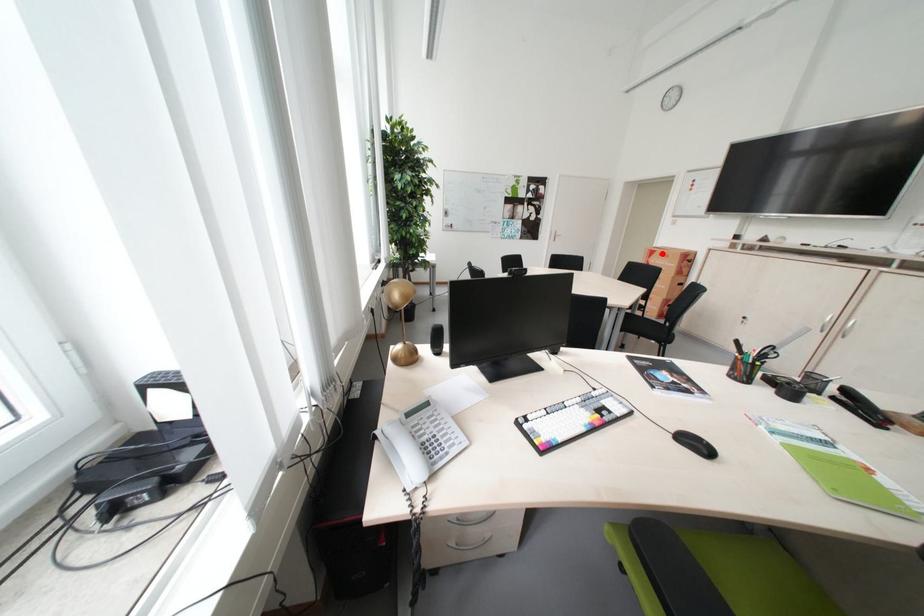
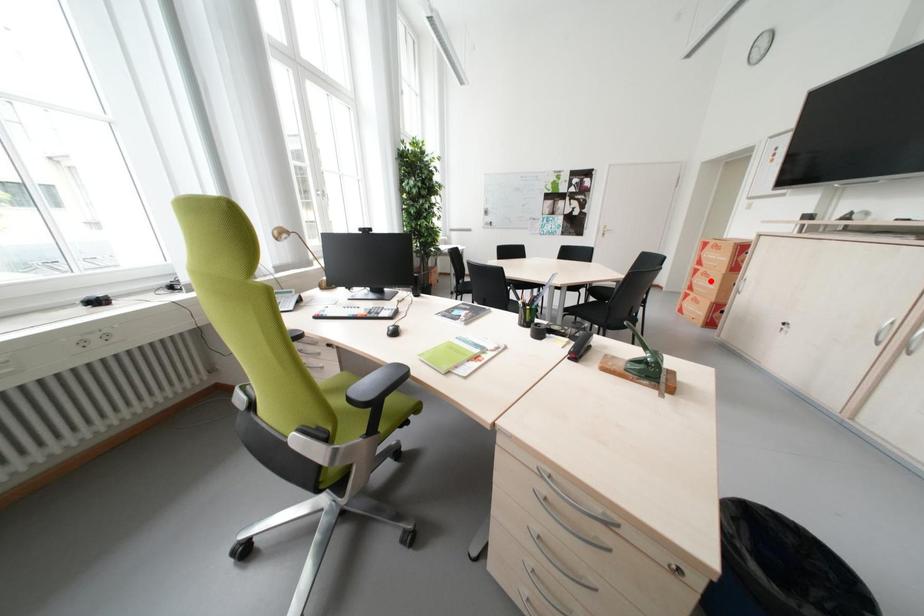
I am providing you with two images of the same scene from different viewpoints. A red point is marked on the first image and another point is marked on the second image. Is the red point in image1 aligned with the point shown in image2?

No